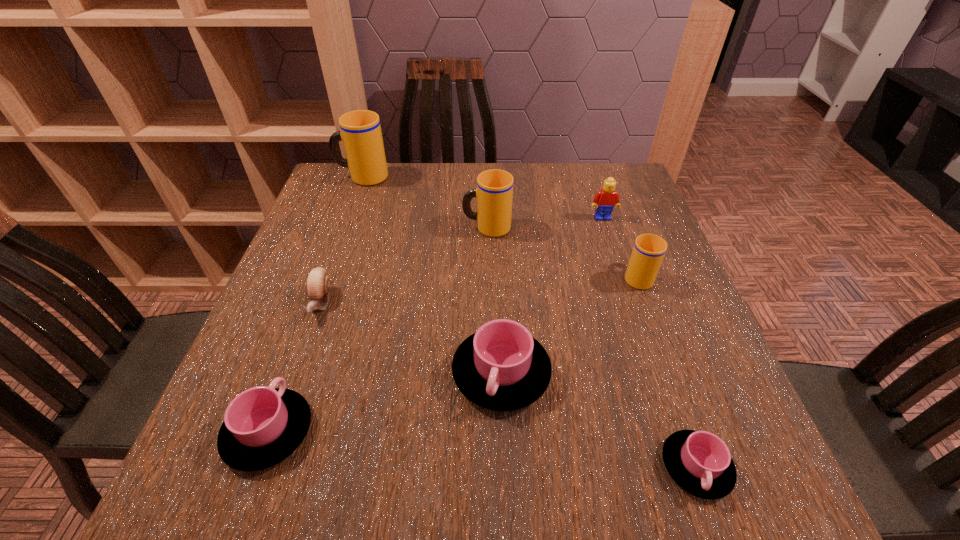
Image resolution: width=960 pixels, height=540 pixels. In order to click on object at the near left corner in this screenshot , I will do `click(263, 425)`.

This screenshot has width=960, height=540. Identify the location of object that is at the near right corner. (699, 462).

Find the location of a particular element. vacant space at the far edge is located at coordinates (529, 194).

You are a GUI agent. You are given a task and a screenshot of the screen. Output one action in this format:
    pyautogui.click(x=<x>, y=<y>)
    Task: Click on the vacant area at the left edge
    The width and height of the screenshot is (960, 540).
    Given the screenshot: What is the action you would take?
    pyautogui.click(x=297, y=370)

Where is `vacant space at the right edge of the desktop`? The width and height of the screenshot is (960, 540). vacant space at the right edge of the desktop is located at coordinates (684, 289).

Image resolution: width=960 pixels, height=540 pixels. Identify the location of free space at the far left corner of the desktop. (352, 190).

This screenshot has height=540, width=960. In order to click on free space between the escargot and the Lego in this screenshot , I will do click(462, 260).

The height and width of the screenshot is (540, 960). I want to click on vacant space that's between the escargot and the fourth nearest cup, so point(479,289).

This screenshot has width=960, height=540. I want to click on free space between the third shortest cup and the nearest beige cup, so click(x=569, y=325).

In order to click on free space between the escargot and the leftmost pink cup in this screenshot , I will do `click(295, 367)`.